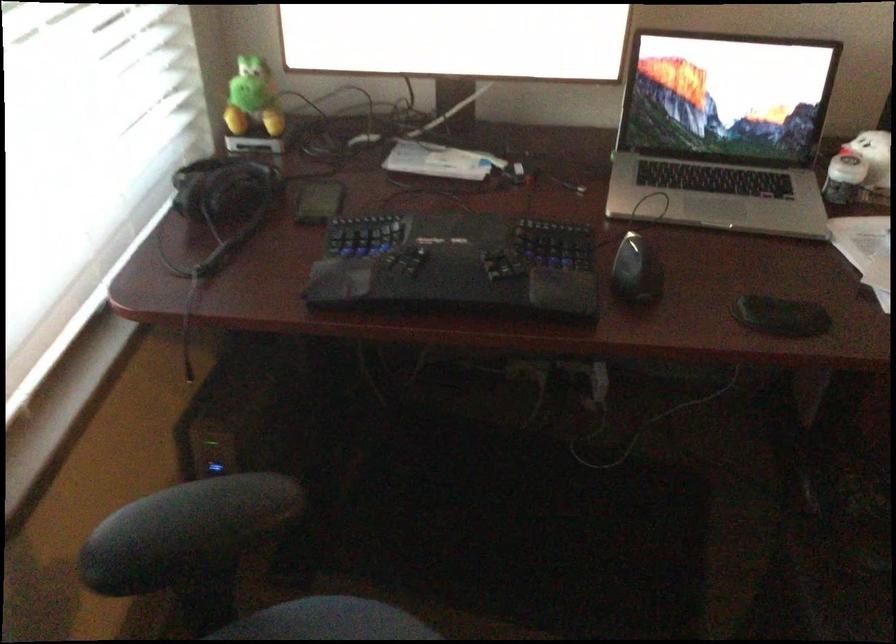
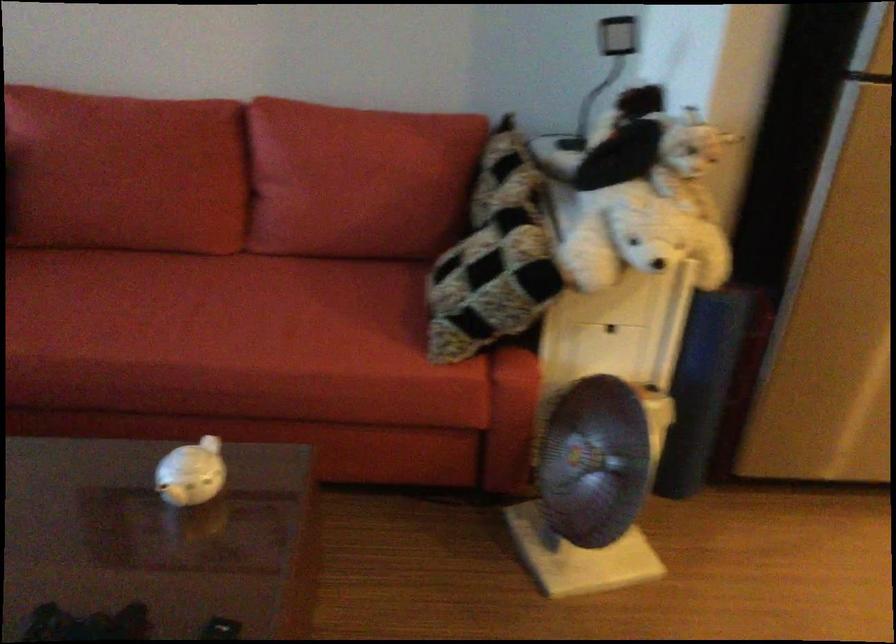
Question: Which direction would the cameraman need to move to produce the second image? Reply with the corresponding letter.

Choices:
 (A) Left
 (B) Right
 (C) Forward
 (D) Backward

Answer: (B)